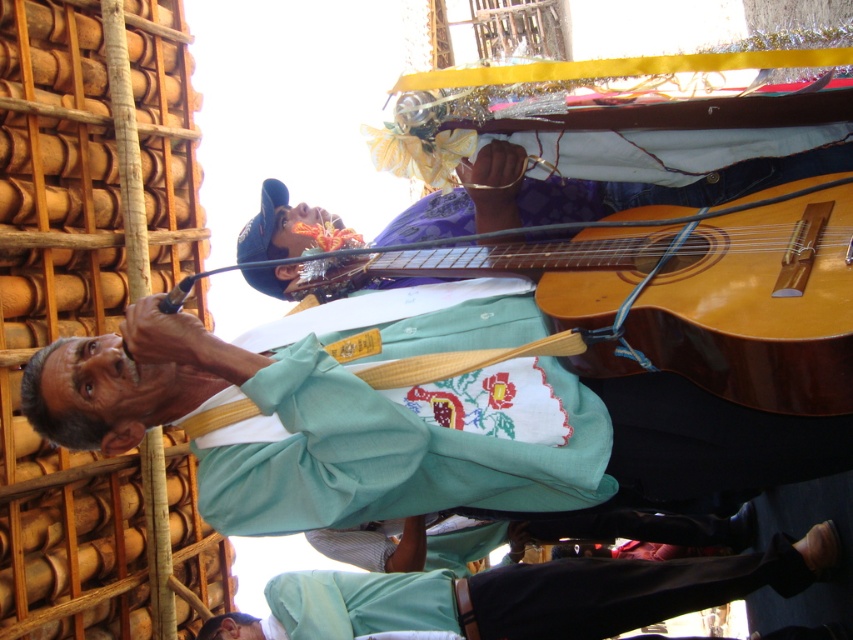
Question: Does light brown wood guitar at center have a larger size compared to light blue fabric pants at lower center?

Choices:
 (A) yes
 (B) no

Answer: (B)

Question: Is the position of light brown wood guitar at center less distant than that of light blue fabric pants at lower center?

Choices:
 (A) yes
 (B) no

Answer: (A)

Question: Which point is closer to the camera?

Choices:
 (A) light blue fabric pants at lower center
 (B) light brown wood guitar at center

Answer: (B)

Question: Does light brown wood guitar at center have a greater width compared to light blue fabric pants at lower center?

Choices:
 (A) no
 (B) yes

Answer: (A)